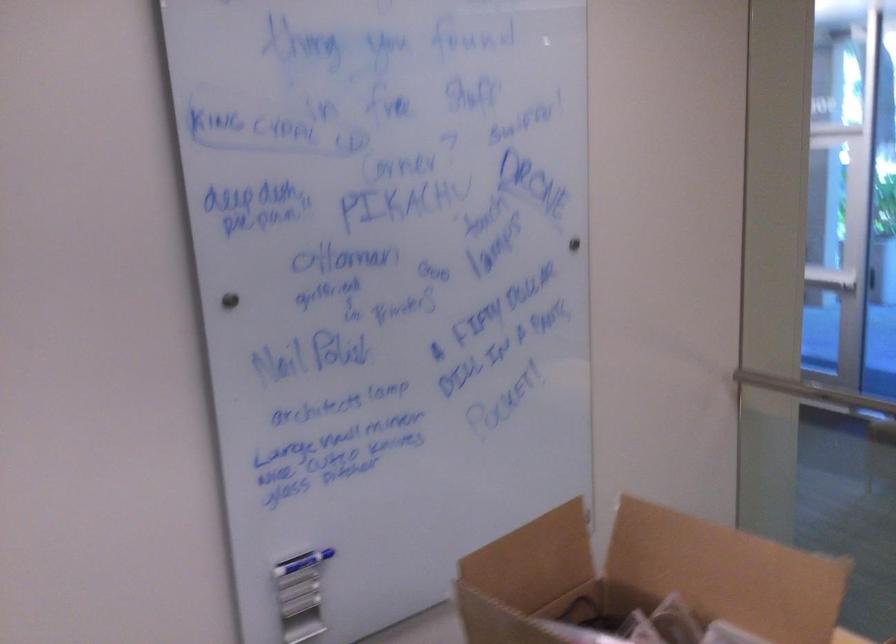
What do you see at coordinates (229, 301) in the screenshot? I see `a metal handle` at bounding box center [229, 301].